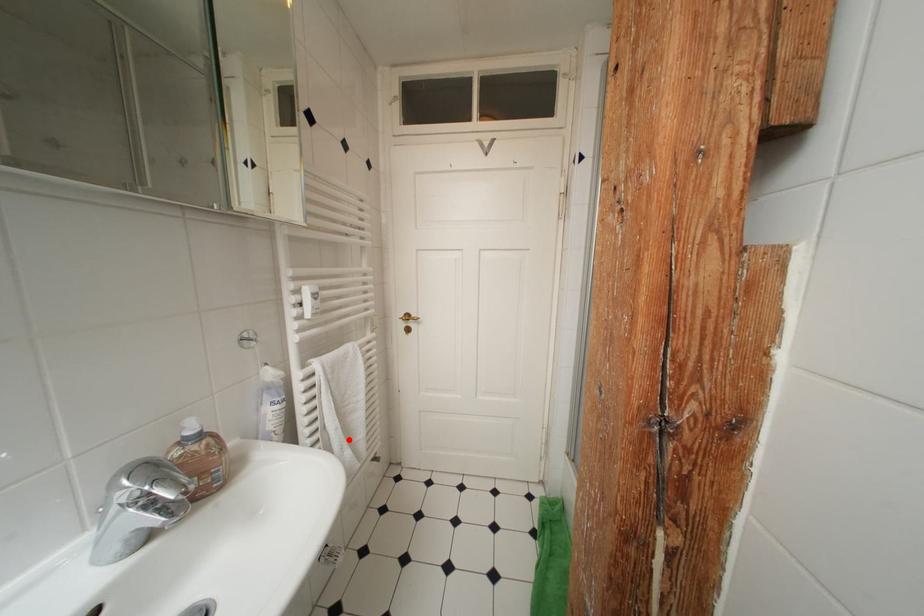
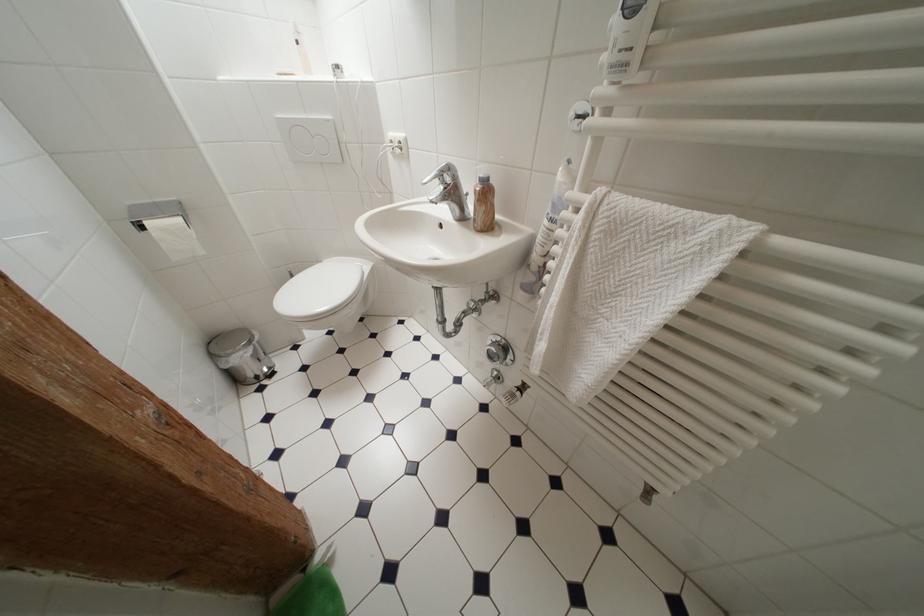
Question: I am providing you with two images of the same scene from different viewpoints. A red point is shown in image1. For the corresponding object point in image2, is it positioned nearer or farther from the camera?

Choices:
 (A) Nearer
 (B) Farther

Answer: (B)